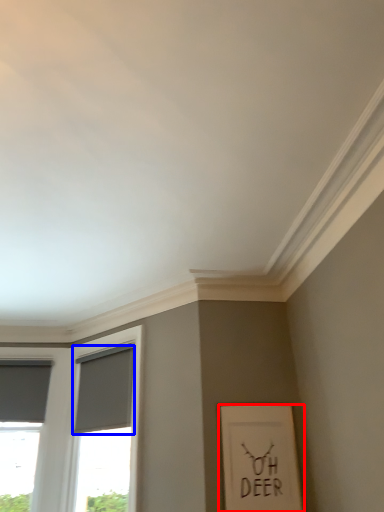
Question: Among these objects, which one is nearest to the camera, picture frame (highlighted by a red box) or curtain (highlighted by a blue box)?

Choices:
 (A) picture frame
 (B) curtain

Answer: (A)